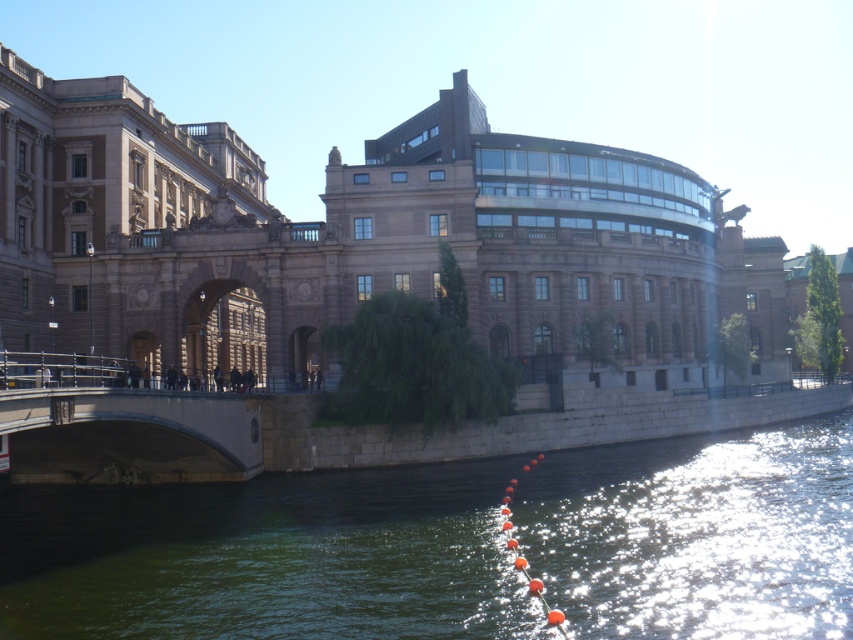
You are a city planner reviewing the urban layout. You need to determine which of the two elements, the green stone river at lower left or the concrete bridge at lower left, occupies more space in the scene. Based on the provided information, which one is larger?

The green stone river at lower left is larger in size than the concrete bridge at lower left according to the description.

You are standing at the center of the image. Which direction should you face to look directly at the green stone river at lower left?

The green stone river at lower left is located at coordinates point (454, 547), so you should turn your head to the lower left direction to face it.

You are standing on the concrete bridge at lower left and want to cross to the other side. Which direction should you walk to avoid the green stone river at lower left?

You should walk to the left to avoid the green stone river at lower left because the river is to the right of the concrete bridge at lower left.